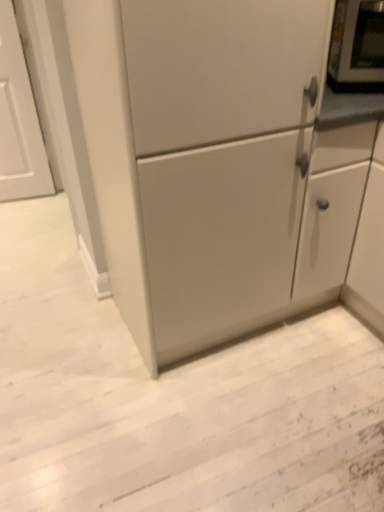
Locate an element on the screen. This screenshot has width=384, height=512. matte white cabinet at center is located at coordinates (224, 168).

Describe the element at coordinates (224, 168) in the screenshot. The height and width of the screenshot is (512, 384). I see `matte white cabinet at center` at that location.

Locate an element on the screen. This screenshot has height=512, width=384. metallic silver microwave at upper right is located at coordinates click(357, 46).

Describe the element at coordinates (357, 46) in the screenshot. I see `metallic silver microwave at upper right` at that location.

At what (x,y) coordinates should I click in order to perform the action: click on matte white cabinet at center. Please return your answer as a coordinate pair (x, y). Looking at the image, I should click on (224, 168).

Based on the photo, considering the positions of objects matte white cabinet at center and metallic silver microwave at upper right in the image provided, who is more to the left, matte white cabinet at center or metallic silver microwave at upper right?

Positioned to the left is matte white cabinet at center.

Between matte white cabinet at center and metallic silver microwave at upper right, which one is positioned behind?

metallic silver microwave at upper right is further from the camera.

Which is behind, point (271, 15) or point (380, 10)?

The point (380, 10) is behind.

From the image's perspective, relative to metallic silver microwave at upper right, is matte white cabinet at center above or below?

Based on their image positions, matte white cabinet at center is located beneath metallic silver microwave at upper right.

From a real-world perspective, is matte white cabinet at center physically located above or below metallic silver microwave at upper right?

In terms of real-world spatial position, matte white cabinet at center is below metallic silver microwave at upper right.

In terms of width, does matte white cabinet at center look wider or thinner when compared to metallic silver microwave at upper right?

Clearly, matte white cabinet at center has more width compared to metallic silver microwave at upper right.

Between matte white cabinet at center and metallic silver microwave at upper right, which one has more height?

matte white cabinet at center is taller.

Which of these two, matte white cabinet at center or metallic silver microwave at upper right, is smaller?

With smaller size is metallic silver microwave at upper right.

Would you say matte white cabinet at center is outside metallic silver microwave at upper right?

Absolutely, matte white cabinet at center is external to metallic silver microwave at upper right.

Is the surface of matte white cabinet at center in direct contact with metallic silver microwave at upper right?

No, matte white cabinet at center is not with metallic silver microwave at upper right.

Is matte white cabinet at center oriented away from metallic silver microwave at upper right?

No, matte white cabinet at center is not facing away from metallic silver microwave at upper right.

What's the angular difference between matte white cabinet at center and metallic silver microwave at upper right's facing directions?

The facing directions of matte white cabinet at center and metallic silver microwave at upper right are 27.3 degrees apart.

Identify the location of appliance lying behind the matte white cabinet at center. (357, 46).

Can you confirm if metallic silver microwave at upper right is positioned to the right of matte white cabinet at center?

Yes.

Which object is further away from the camera, metallic silver microwave at upper right or matte white cabinet at center?

Positioned behind is metallic silver microwave at upper right.

Does point (368, 44) lie in front of point (234, 181)?

No, (368, 44) is further to viewer.

From the image's perspective, which one is positioned lower, metallic silver microwave at upper right or matte white cabinet at center?

matte white cabinet at center.

From a real-world perspective, relative to matte white cabinet at center, is metallic silver microwave at upper right vertically above or below?

In terms of real-world spatial position, metallic silver microwave at upper right is above matte white cabinet at center.

Considering the relative sizes of metallic silver microwave at upper right and matte white cabinet at center in the image provided, is metallic silver microwave at upper right wider than matte white cabinet at center?

No, metallic silver microwave at upper right is not wider than matte white cabinet at center.

Considering the sizes of objects metallic silver microwave at upper right and matte white cabinet at center in the image provided, who is shorter, metallic silver microwave at upper right or matte white cabinet at center?

metallic silver microwave at upper right is shorter.

Considering the sizes of metallic silver microwave at upper right and matte white cabinet at center in the image, is metallic silver microwave at upper right bigger or smaller than matte white cabinet at center?

In the image, metallic silver microwave at upper right appears to be smaller than matte white cabinet at center.

From the picture: Is metallic silver microwave at upper right spatially inside matte white cabinet at center, or outside of it?

metallic silver microwave at upper right is not enclosed by matte white cabinet at center.

Is metallic silver microwave at upper right touching matte white cabinet at center?

No, metallic silver microwave at upper right is not beside matte white cabinet at center.

Is metallic silver microwave at upper right facing away from matte white cabinet at center?

No, metallic silver microwave at upper right is not facing the opposite direction of matte white cabinet at center.

What's the angular difference between metallic silver microwave at upper right and matte white cabinet at center's facing directions?

27.3 degrees.

Image resolution: width=384 pixels, height=512 pixels. In order to click on cabinetry to the left of metallic silver microwave at upper right in this screenshot , I will do `click(224, 168)`.

This screenshot has height=512, width=384. Find the location of `cabinetry that appears below the metallic silver microwave at upper right (from a real-world perspective)`. cabinetry that appears below the metallic silver microwave at upper right (from a real-world perspective) is located at coordinates (224, 168).

The image size is (384, 512). I want to click on appliance above the matte white cabinet at center (from the image's perspective), so click(x=357, y=46).